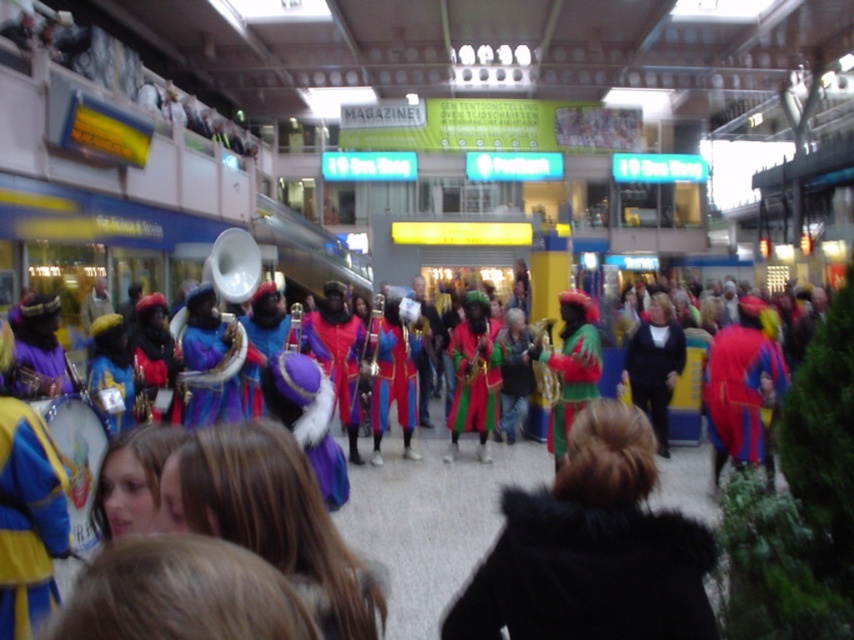
Is blue velvet hat at lower left thinner than shiny red fabric at right?

Indeed, blue velvet hat at lower left has a lesser width compared to shiny red fabric at right.

Identify the location of blue velvet hat at lower left. (28, 518).

The width and height of the screenshot is (854, 640). Describe the element at coordinates (28, 518) in the screenshot. I see `blue velvet hat at lower left` at that location.

Identify the location of blue velvet hat at lower left. (28, 518).

Does velvet purple robe at center appear over green velvet costume at center?

Yes.

The image size is (854, 640). Describe the element at coordinates (214, 368) in the screenshot. I see `velvet purple robe at center` at that location.

You are a GUI agent. You are given a task and a screenshot of the screen. Output one action in this format:
    pyautogui.click(x=<x>, y=<y>)
    Task: Click on the velvet purple robe at center
    This screenshot has height=640, width=854.
    Given the screenshot: What is the action you would take?
    pyautogui.click(x=214, y=368)

Between point (681, 484) and point (753, 376), which one is positioned behind?

Positioned behind is point (681, 484).

Measure the distance between point (376, 552) and camera.

They are 18.85 feet apart.

The image size is (854, 640). What are the coordinates of `multicolored costume at center` in the screenshot? It's located at 430,524.